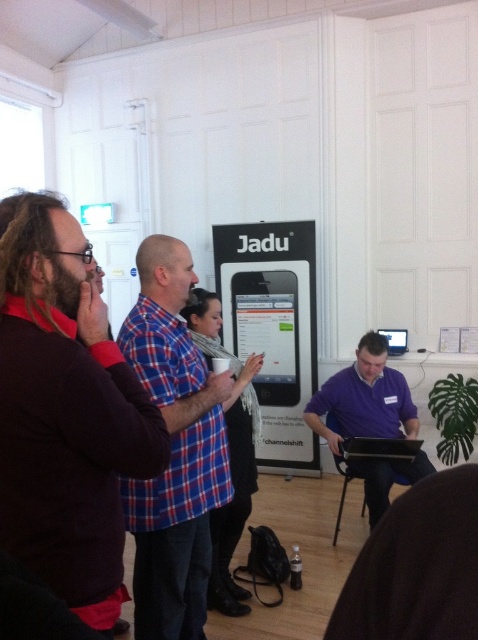
Question: Is dark brown sweater at left to the right of purple matte shirt at center from the viewer's perspective?

Choices:
 (A) no
 (B) yes

Answer: (A)

Question: Is dark brown sweater at left to the right of purple matte shirt at center from the viewer's perspective?

Choices:
 (A) no
 (B) yes

Answer: (A)

Question: Considering the real-world distances, which object is farthest from the black plastic laptop at center?

Choices:
 (A) blue plaid shirt at center
 (B) dark brown sweater at left

Answer: (B)

Question: Is dark brown sweater at left to the right of purple matte shirt at center from the viewer's perspective?

Choices:
 (A) no
 (B) yes

Answer: (A)

Question: Which point appears farthest from the camera in this image?

Choices:
 (A) (130, 316)
 (B) (359, 374)
 (C) (354, 452)
 (D) (4, 474)

Answer: (B)

Question: Which object is farther from the camera taking this photo?

Choices:
 (A) dark brown sweater at left
 (B) black plastic laptop at center

Answer: (B)